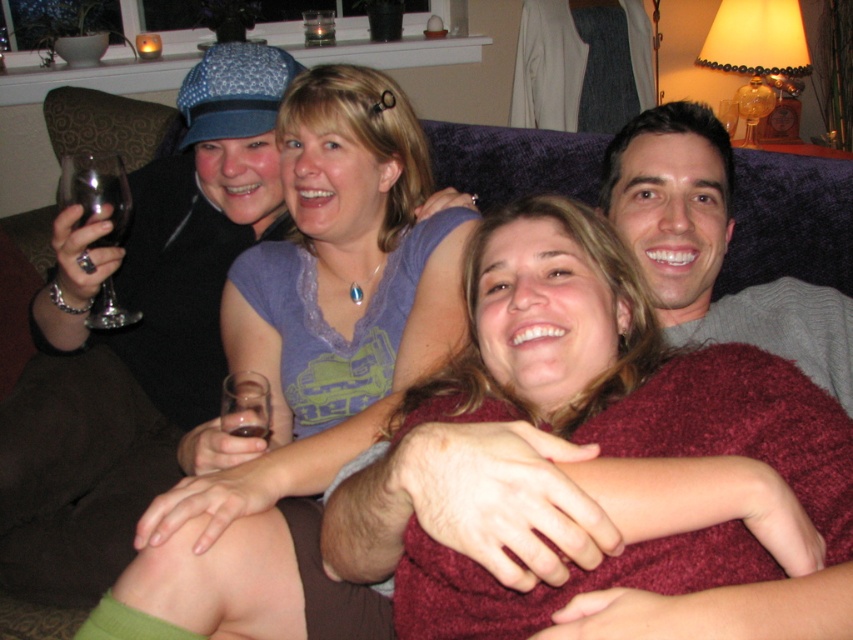
Question: Which of the following is the farthest from the observer?

Choices:
 (A) transparent glass wine glass at left
 (B) translucent glass wine at center
 (C) transparent plastic wine glass at upper center

Answer: (C)

Question: Can you confirm if gray sweater at upper right is thinner than transparent plastic wine glass at upper center?

Choices:
 (A) no
 (B) yes

Answer: (A)

Question: Does matte purple shirt at center come behind translucent glass wine at center?

Choices:
 (A) yes
 (B) no

Answer: (B)

Question: Which point appears farthest from the camera in this image?

Choices:
 (A) (727, 118)
 (B) (219, 417)
 (C) (62, 161)
 (D) (294, 92)

Answer: (A)

Question: Which point is farther to the camera?

Choices:
 (A) gray sweater at upper right
 (B) translucent glass wine at center
 (C) transparent plastic wine glass at upper center

Answer: (C)

Question: Does translucent glass wine at center have a greater width compared to transparent plastic wine glass at upper center?

Choices:
 (A) yes
 (B) no

Answer: (B)